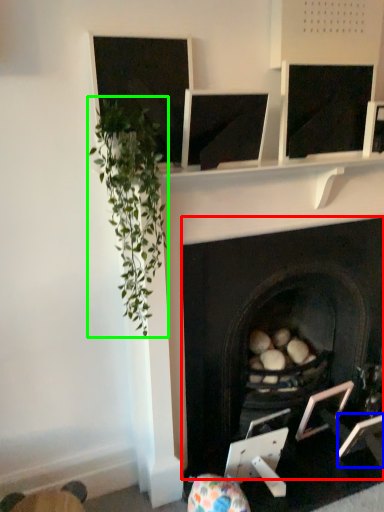
Question: Considering the real-world distances, which object is closest to fireplace (highlighted by a red box)? picture frame (highlighted by a blue box) or plant (highlighted by a green box).

Choices:
 (A) picture frame
 (B) plant

Answer: (B)